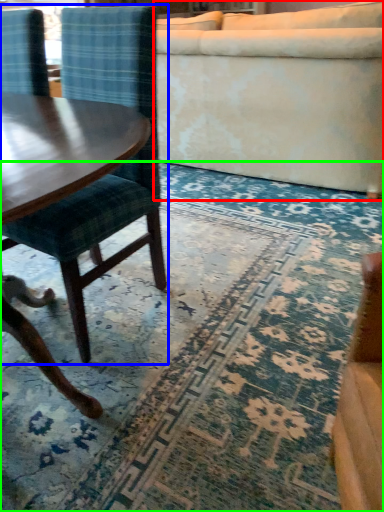
Question: Based on their relative distances, which object is nearer to studio couch (highlighted by a red box)? Choose from chair (highlighted by a blue box) and mat (highlighted by a green box).

Choices:
 (A) chair
 (B) mat

Answer: (B)